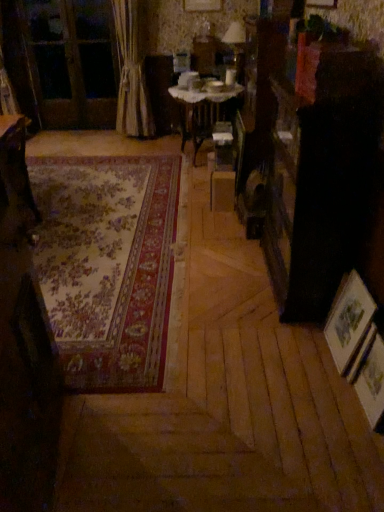
Question: Should I look upward or downward to see wooden table at left, marked as the 2th table in a right-to-left arrangement?

Choices:
 (A) up
 (B) down

Answer: (A)

Question: Can you confirm if wooden table at left, the first table viewed from the left, is positioned to the left of wooden picture frame at lower right, which is the first picture frame in front-to-back order?

Choices:
 (A) no
 (B) yes

Answer: (B)

Question: From the image's perspective, does wooden table at left, marked as the 2th table in a right-to-left arrangement, appear higher than wooden picture frame at lower right, which is the first picture frame in front-to-back order?

Choices:
 (A) yes
 (B) no

Answer: (A)

Question: Is wooden table at left, the second table in the top-to-bottom sequence, taller than wooden picture frame at lower right, marked as the second picture frame in a back-to-front arrangement?

Choices:
 (A) yes
 (B) no

Answer: (A)

Question: Can you confirm if wooden table at left, acting as the 1th table starting from the bottom, is wider than wooden picture frame at lower right, which is the first picture frame in front-to-back order?

Choices:
 (A) yes
 (B) no

Answer: (A)

Question: Does wooden table at left, which ranks as the first table in front-to-back order, lie in front of wooden picture frame at lower right, marked as the second picture frame in a back-to-front arrangement?

Choices:
 (A) no
 (B) yes

Answer: (A)

Question: Is wooden table at left, the second table in the top-to-bottom sequence, beside wooden picture frame at lower right, marked as the second picture frame in a back-to-front arrangement?

Choices:
 (A) no
 (B) yes

Answer: (A)

Question: Could wooden screen door at upper left be considered to be inside wooden picture frame at lower right, which is the first picture frame in front-to-back order?

Choices:
 (A) yes
 (B) no

Answer: (B)

Question: Is wooden picture frame at lower right, which is the first picture frame in front-to-back order, not close to wooden screen door at upper left?

Choices:
 (A) no
 (B) yes

Answer: (B)

Question: From the image's perspective, is wooden picture frame at lower right, which is the first picture frame in front-to-back order, located above wooden screen door at upper left?

Choices:
 (A) no
 (B) yes

Answer: (A)

Question: Considering the relative sizes of wooden picture frame at lower right, which is the first picture frame in front-to-back order, and wooden screen door at upper left in the image provided, is wooden picture frame at lower right, which is the first picture frame in front-to-back order, bigger than wooden screen door at upper left?

Choices:
 (A) yes
 (B) no

Answer: (B)

Question: Does wooden picture frame at lower right, which is the first picture frame in front-to-back order, appear on the left side of wooden screen door at upper left?

Choices:
 (A) no
 (B) yes

Answer: (A)

Question: Is wooden screen door at upper left at the back of wooden picture frame at lower right, marked as the second picture frame in a back-to-front arrangement?

Choices:
 (A) yes
 (B) no

Answer: (B)

Question: Does matte glass table lamp at upper center have a greater width compared to beige fabric curtain at left?

Choices:
 (A) yes
 (B) no

Answer: (B)